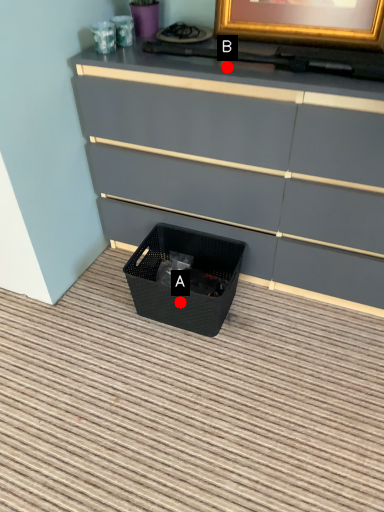
Question: Two points are circled on the image, labeled by A and B beside each circle. Which point appears closest to the camera in this image?

Choices:
 (A) A is closer
 (B) B is closer

Answer: (B)